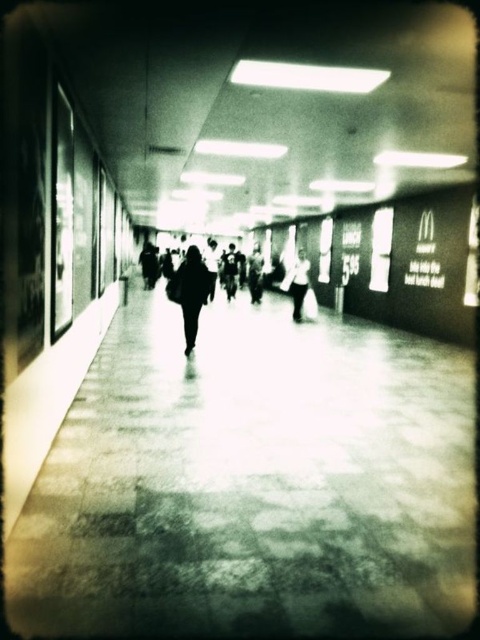
You are standing at the entrance of the corridor and see the dark fabric jacket at center. If you want to reach the jacket, which direction should you move relative to your current position?

Since the dark fabric jacket at center is located at the center of the corridor, you should move forward straight ahead to reach it.

In the scene shown: You are standing in the corridor and see a dark fabric jacket at center and a white cotton shirt at center. Which one is more to the left?

The dark fabric jacket at center is more to the left side of the white cotton shirt at center.